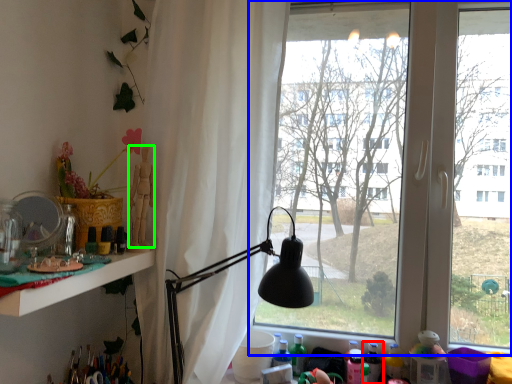
Question: Which object is positioned farthest from bottle (highlighted by a red box)? Select from window (highlighted by a blue box) and person (highlighted by a green box).

Choices:
 (A) window
 (B) person

Answer: (B)